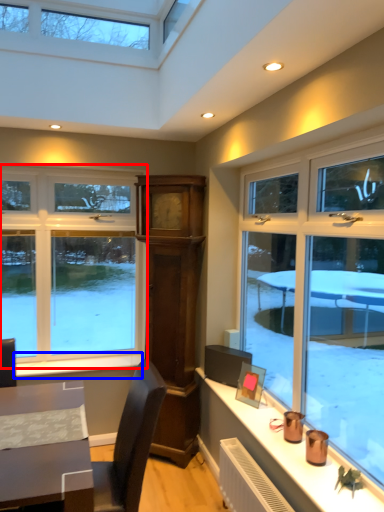
Question: Which object is closer to the camera taking this photo, window (highlighted by a red box) or window sill (highlighted by a blue box)?

Choices:
 (A) window
 (B) window sill

Answer: (B)